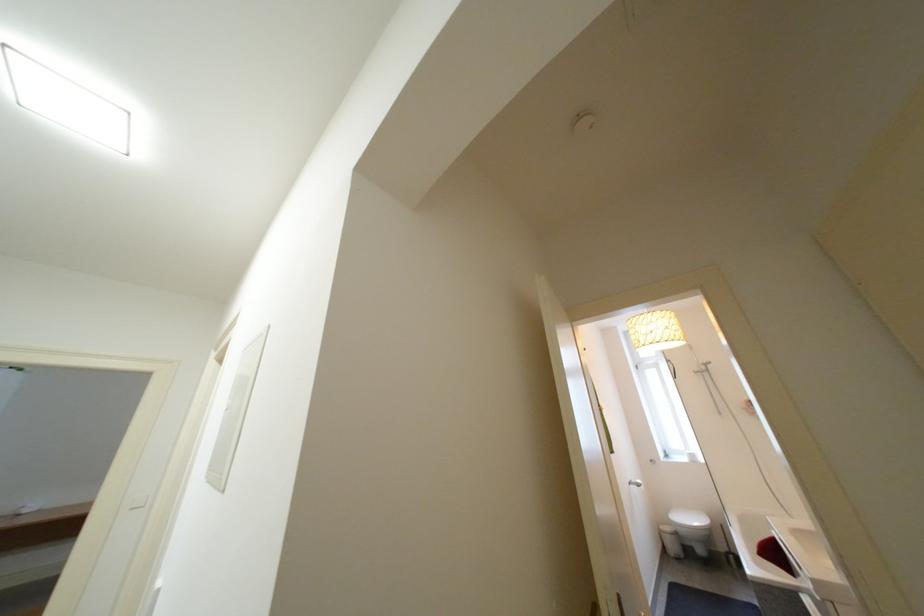
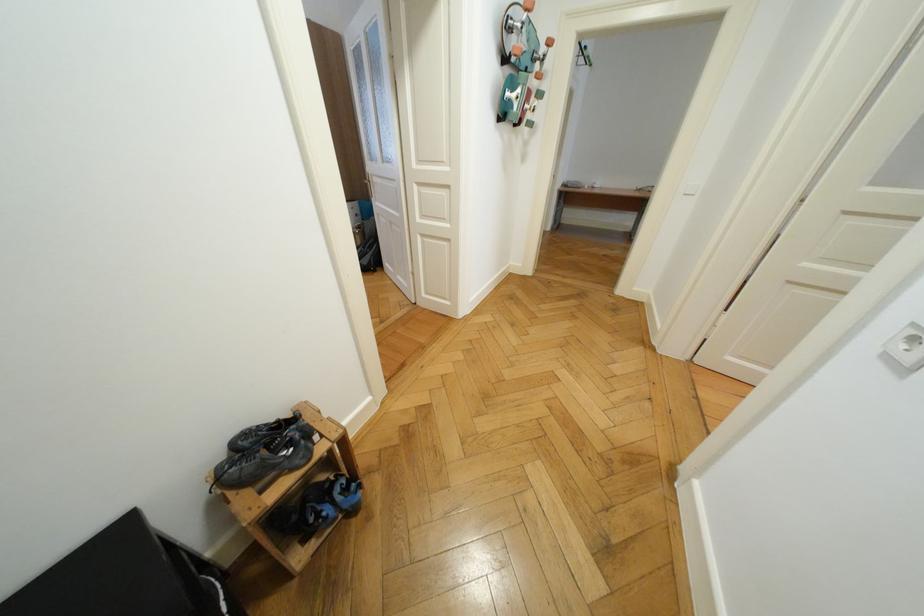
The point at (141, 509) is marked in the first image. Where is the corresponding point in the second image?

(695, 196)